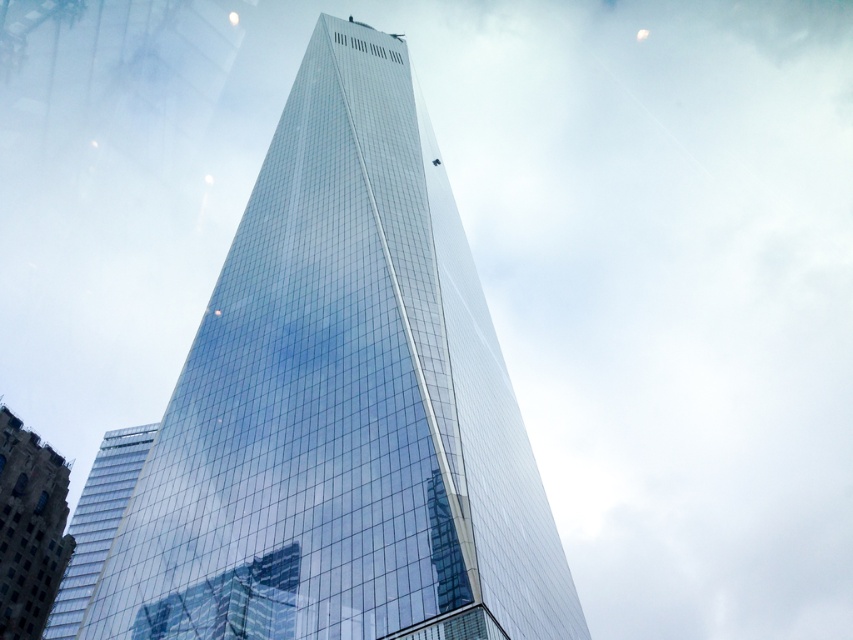
You are an architect evaluating the skyline of this city. You notice the transparent glass tower at center and the glassy reflective building at lower left. Which one has a greater height?

The transparent glass tower at center is much taller than the glassy reflective building at lower left, so it has a greater height.

You are standing at the center of the image. You want to walk towards the transparent glass tower at center. In which direction should you move?

The transparent glass tower at center is already at the center of the image, so you are already facing it. Move straight ahead.

You are an architect reviewing a cityscape design. You notice the transparent glass tower at center and the glassy reflective building at lower left. Which building is located to the right of the other?

The transparent glass tower at center is positioned on the right side of the glassy reflective building at lower left.